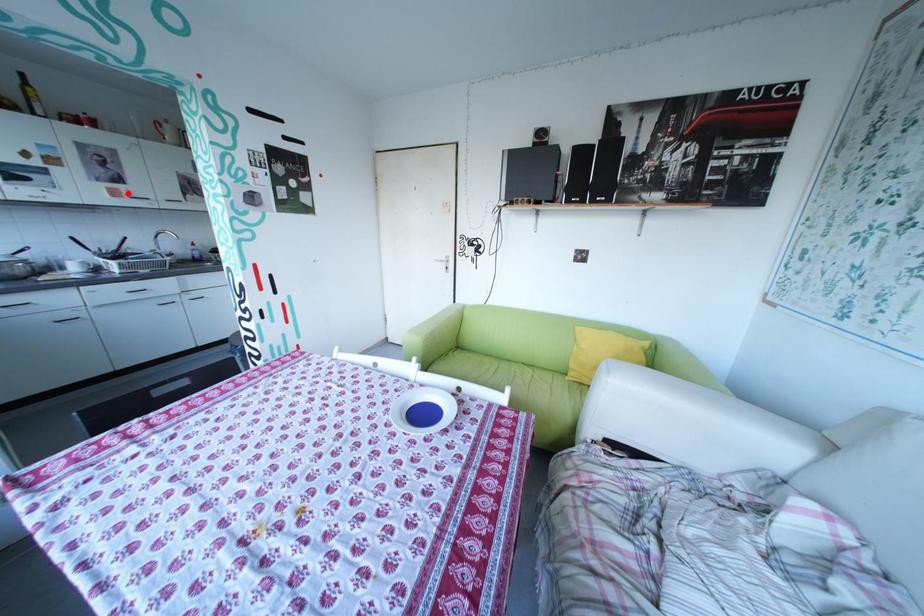
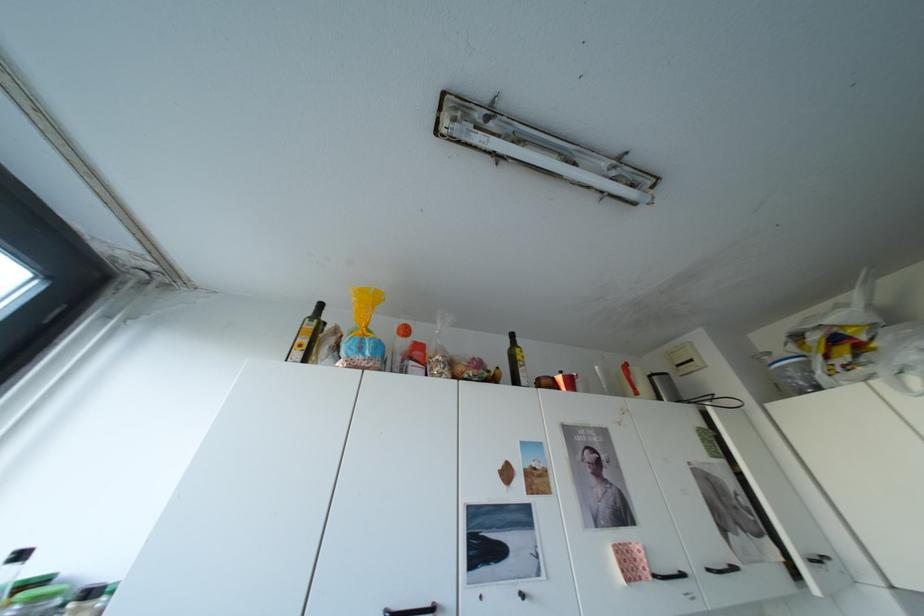
Locate, in the second image, the point that corresponds to the highlighted location in the first image.

(642, 568)